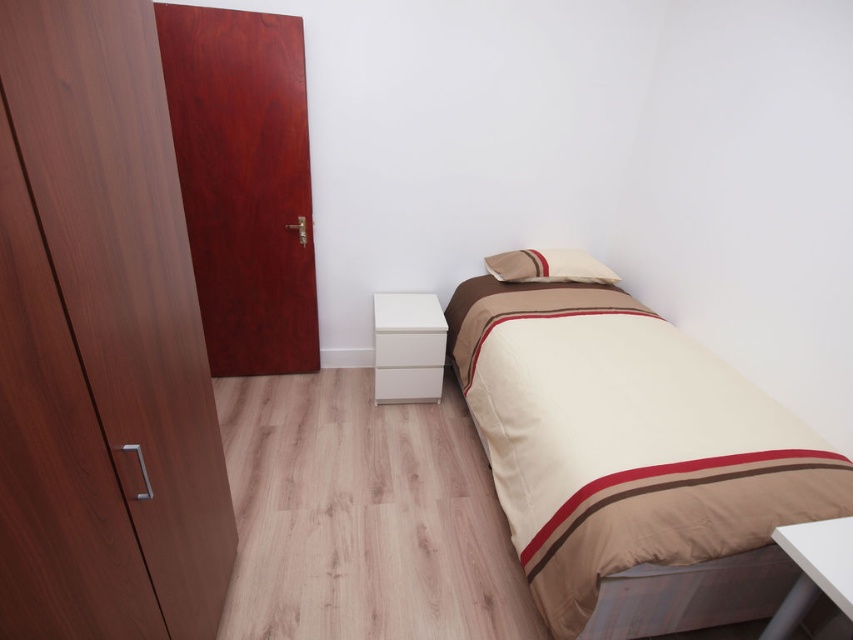
Between matte wood dresser at left and white matte drawer at lower center, which one has more height?

matte wood dresser at left is taller.

Can you confirm if matte wood dresser at left is smaller than white matte drawer at lower center?

Actually, matte wood dresser at left might be larger than white matte drawer at lower center.

Is point (177, 211) less distant than point (425, 346)?

Yes, it is.

Identify the location of matte wood dresser at left. (100, 342).

Is beige fabric bed at right above white matte drawer at lower center?

No, beige fabric bed at right is not above white matte drawer at lower center.

Based on the photo, between beige fabric bed at right and white matte drawer at lower center, which one appears on the right side from the viewer's perspective?

Positioned to the right is beige fabric bed at right.

Based on the photo, who is more forward, (561, 538) or (439, 353)?

Positioned in front is point (561, 538).

Where is `beige fabric bed at right`? The width and height of the screenshot is (853, 640). beige fabric bed at right is located at coordinates click(x=624, y=440).

Is beige soft pillow at upper center smaller than white matte drawer at lower center?

Actually, beige soft pillow at upper center might be larger than white matte drawer at lower center.

Can you confirm if beige soft pillow at upper center is shorter than white matte drawer at lower center?

No.

Find the location of `beige soft pillow at upper center`. beige soft pillow at upper center is located at coordinates (548, 266).